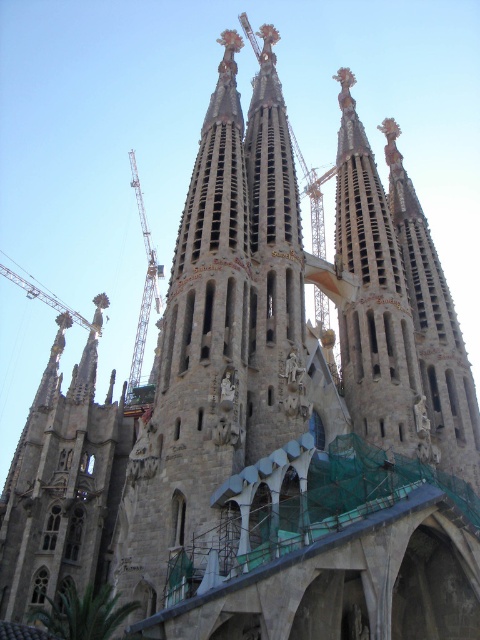
Question: Does metallic construction crane at center have a lesser width compared to metallic construction crane at upper left?

Choices:
 (A) yes
 (B) no

Answer: (A)

Question: Is metallic construction crane at center smaller than metallic construction crane at upper left?

Choices:
 (A) no
 (B) yes

Answer: (A)

Question: Does metallic construction crane at center appear over metallic construction crane at upper left?

Choices:
 (A) yes
 (B) no

Answer: (B)